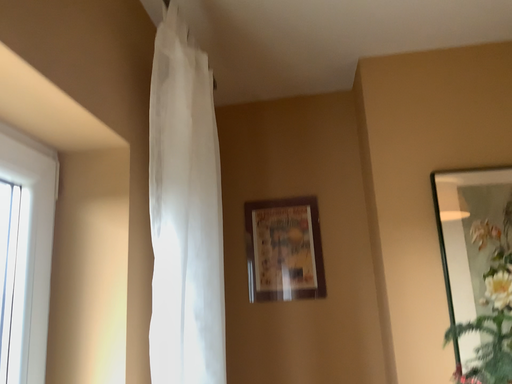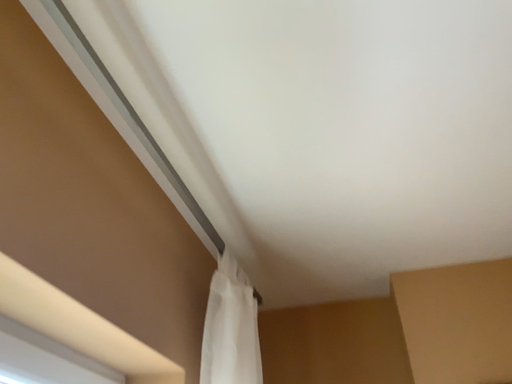
Question: Which way did the camera rotate in the video?

Choices:
 (A) rotated upward
 (B) rotated downward

Answer: (A)